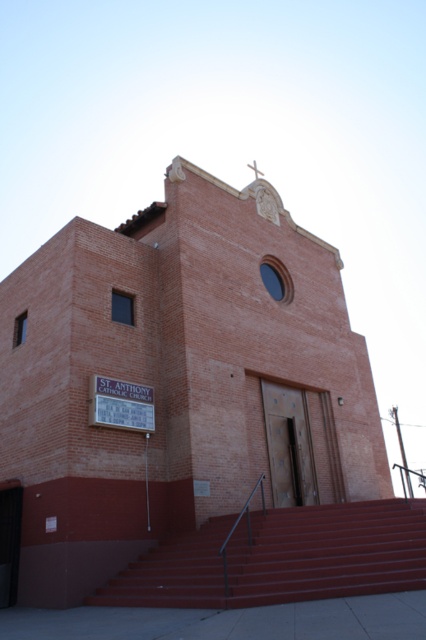
Question: Which object is farther from the camera taking this photo?

Choices:
 (A) maroon painted stairs at center
 (B) brick church at center

Answer: (B)

Question: Which of the following is the closest to the observer?

Choices:
 (A) (362, 512)
 (B) (357, 388)

Answer: (A)

Question: Is brick church at center wider than maroon painted stairs at center?

Choices:
 (A) no
 (B) yes

Answer: (B)

Question: Does brick church at center come behind maroon painted stairs at center?

Choices:
 (A) no
 (B) yes

Answer: (B)

Question: Considering the relative positions of brick church at center and maroon painted stairs at center in the image provided, where is brick church at center located with respect to maroon painted stairs at center?

Choices:
 (A) left
 (B) right

Answer: (A)